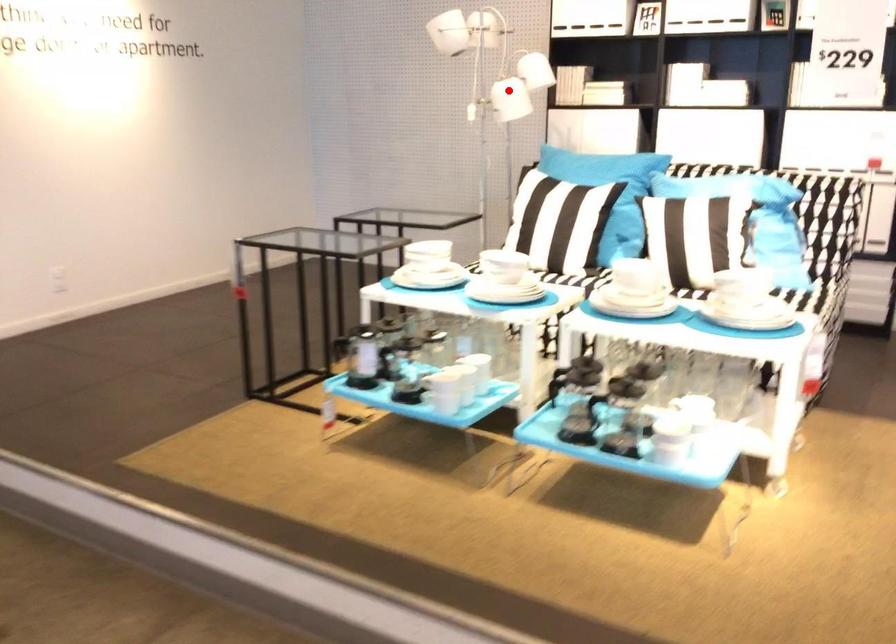
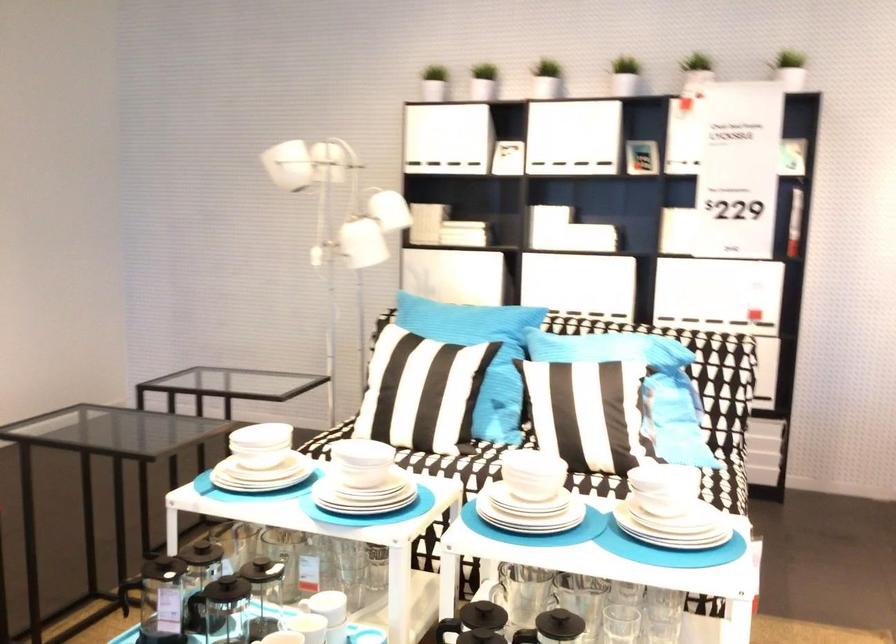
Question: I am providing you with two images of the same scene from different viewpoints. In image1, a red point is highlighted. Considering the same 3D point in image2, which of the following is correct?

Choices:
 (A) It is closer
 (B) It is farther

Answer: (A)